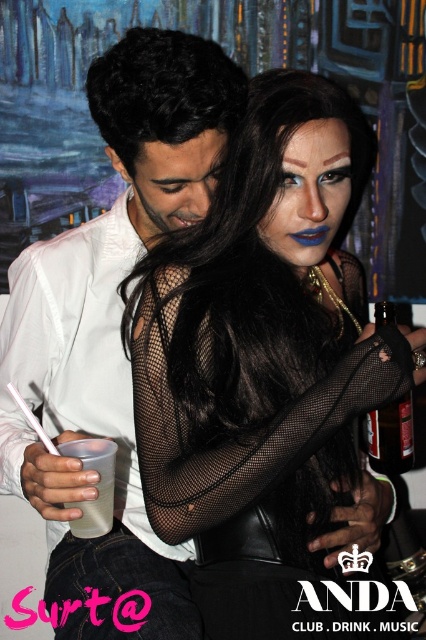
You are a photographer at the event and want to capture a closeup of both the black fishnet gloves at center and the white matte shirt at center in the same frame. Given that your camera has a focal length of 50mm and a sensor size of 24x36mm, what is the minimum distance you need to stand from the subjects to ensure both objects are in focus and within the frame?

The minimum distance required is calculated using the hyperfocal distance formula, considering the sensor size, focal length, and acceptable circle of confusion. However, since the objects are only 7.21 inches apart and relatively close to each other, you can focus at the midpoint between them. To ensure both are in focus, the photographer should position themselves approximately 7.21 inches away from the subjects.

You are a bartender at the nightclub and need to pour a drink from the brown glass bottle at center right into the translucent plastic cup at lower left. Will the cup be able to hold the entire contents of the bottle without spilling?

The brown glass bottle at center right is taller than the translucent plastic cup at lower left. Since the bottle is taller, it likely has a larger capacity, so pouring its contents into the cup may cause overflow and spilling.